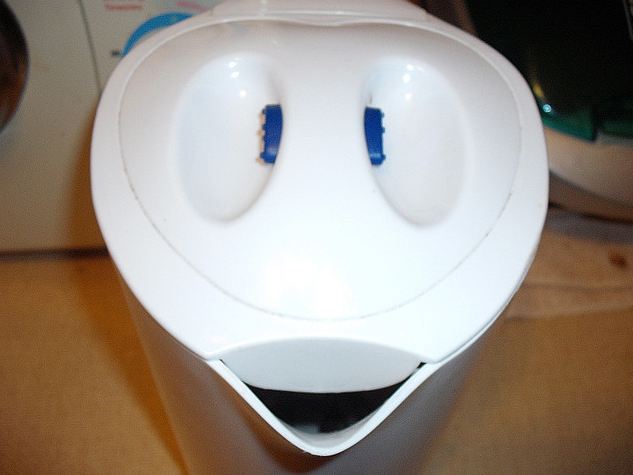
You are a GUI agent. You are given a task and a screenshot of the screen. Output one action in this format:
    pyautogui.click(x=<x>, y=<y>)
    Task: Click on the glare from kitchen lights
    The height and width of the screenshot is (475, 633).
    Given the screenshot: What is the action you would take?
    pyautogui.click(x=408, y=82)